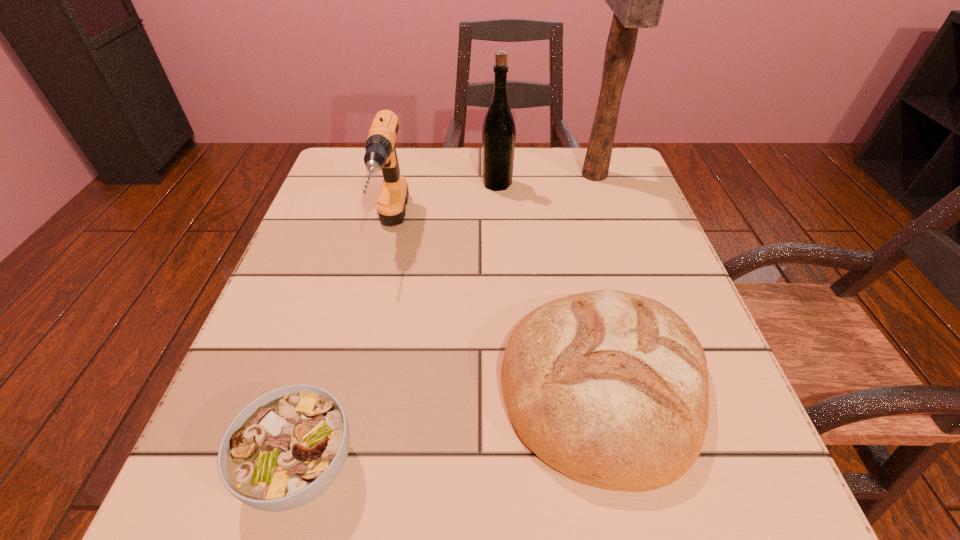
Locate an element on the screen. The image size is (960, 540). mallet present at the far edge is located at coordinates (637, 0).

Locate an element on the screen. beer bottle present at the far edge is located at coordinates (498, 132).

Locate an element on the screen. Image resolution: width=960 pixels, height=540 pixels. drill that is at the far edge is located at coordinates (380, 148).

Identify the location of bread that is at the near edge. (610, 388).

At what (x,y) coordinates should I click in order to perform the action: click on soup bowl at the near edge. Please return your answer as a coordinate pair (x, y). The height and width of the screenshot is (540, 960). Looking at the image, I should click on (286, 448).

Locate an element on the screen. Image resolution: width=960 pixels, height=540 pixels. drill present at the left edge is located at coordinates (380, 148).

Identify the location of soup bowl situated at the left edge. (286, 448).

Locate an element on the screen. The height and width of the screenshot is (540, 960). mallet that is at the right edge is located at coordinates (637, 0).

What are the coordinates of `bread that is at the right edge` in the screenshot? It's located at (610, 388).

You are a GUI agent. You are given a task and a screenshot of the screen. Output one action in this format:
    pyautogui.click(x=<x>, y=<y>)
    Task: Click on the object that is at the far left corner
    
    Given the screenshot: What is the action you would take?
    pyautogui.click(x=380, y=148)